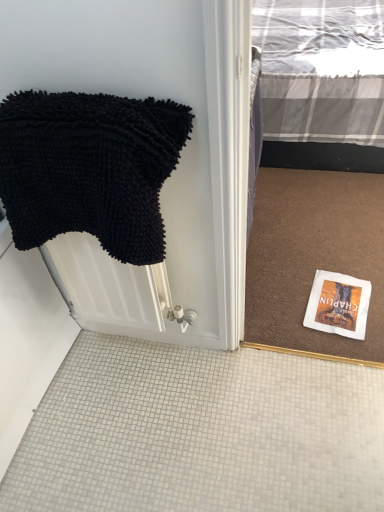
Find the location of a particular element. This screenshot has width=384, height=512. vacant point above white paper book cover at lower right (from a real-world perspective) is located at coordinates (337, 303).